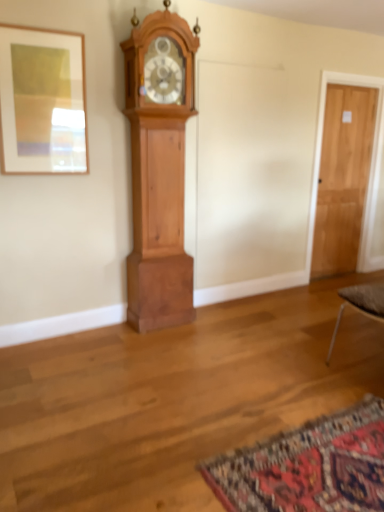
This screenshot has width=384, height=512. Identify the location of free space to the right of cherry wood grandfather clock at left. (216, 322).